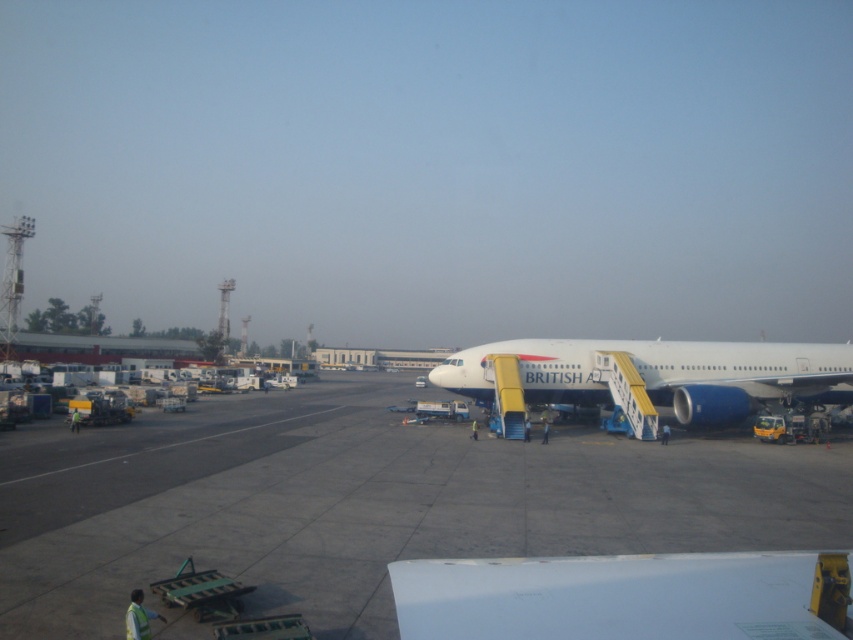
You are a maintenance worker on the airport tarmac. You need to inspect the white matte airplane at center and the gray concrete tarmac at center. Which object is positioned lower from the ground?

The gray concrete tarmac at center is located below the white matte airplane at center, so the gray concrete tarmac at center is positioned lower from the ground.

You are a pilot standing on the gray concrete tarmac at center. You need to board the white matte airplane at center. Which direction should you walk to reach the airplane?

The gray concrete tarmac at center is in front of the white matte airplane at center, so you should walk backward to reach the airplane.

You are a drone operator tasked with landing a drone on the gray concrete tarmac at center. The drone has a landing tolerance of 0.05 units in both x and y coordinates. Given that the target point is at coordinates point (366,502), will the drone be able to land safely within the designated area?

The point (366,502) indicates gray concrete tarmac at center, so yes, the drone can land safely within the designated area as the coordinates are within the landing tolerance of 0.05 units in both x and y directions.